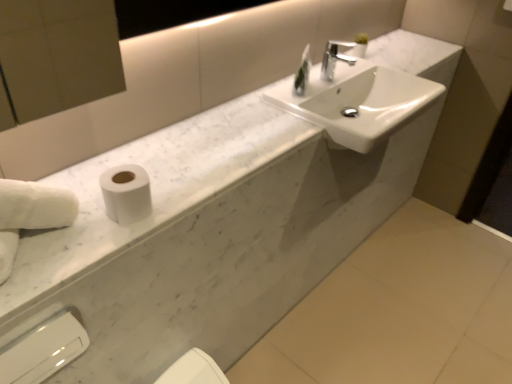
Locate an element on the screen. The height and width of the screenshot is (384, 512). vacant space that is in between white matte toilet paper at left and white fluffy hand towel at left is located at coordinates (82, 230).